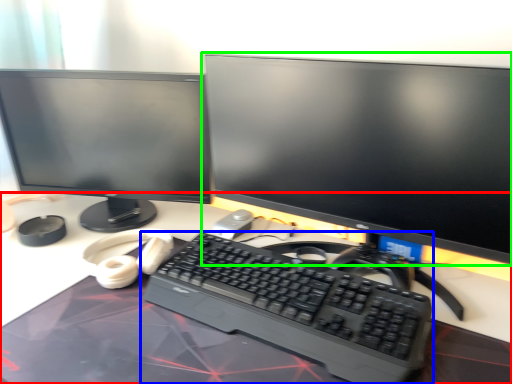
Question: Which object is positioned farthest from desk (highlighted by a red box)? Select from computer keyboard (highlighted by a blue box) and computer monitor (highlighted by a green box).

Choices:
 (A) computer keyboard
 (B) computer monitor

Answer: (B)